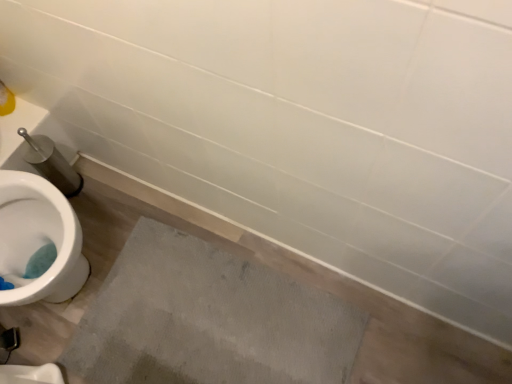
Locate an element on the screen. The height and width of the screenshot is (384, 512). vacant point above gray textured concrete at lower center (from a real-world perspective) is located at coordinates (210, 327).